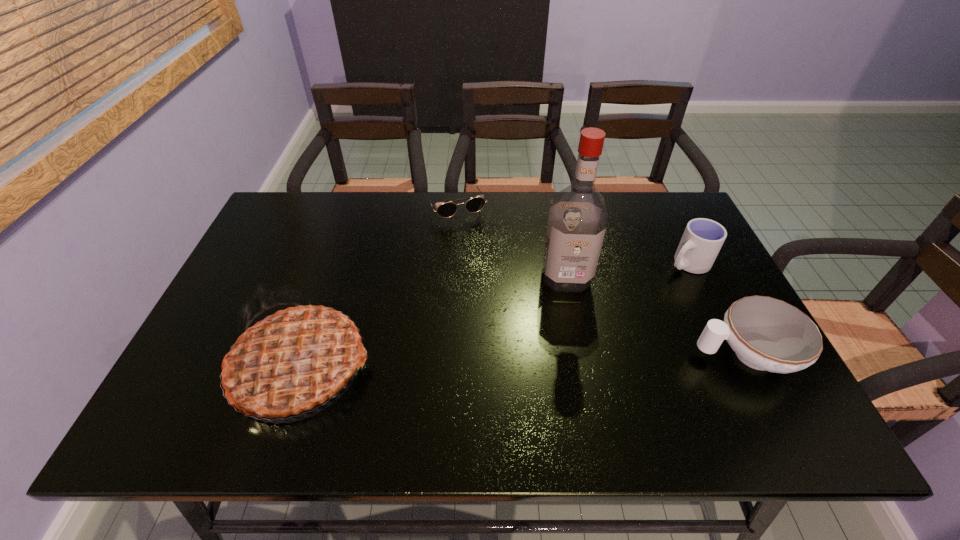
The image size is (960, 540). What are the coordinates of `vacant area located 0.070m on the front lenses of the sunglasses` in the screenshot? It's located at (471, 239).

The height and width of the screenshot is (540, 960). In order to click on object that is at the far edge in this screenshot , I will do `click(473, 205)`.

You are a GUI agent. You are given a task and a screenshot of the screen. Output one action in this format:
    pyautogui.click(x=<x>, y=<y>)
    Task: Click on the pie at the near edge
    The image size is (960, 540).
    Given the screenshot: What is the action you would take?
    pyautogui.click(x=292, y=360)

Find the location of a particular element. This screenshot has width=960, height=540. chinaware that is at the near edge is located at coordinates (769, 334).

This screenshot has width=960, height=540. I want to click on object located in the left edge section of the desktop, so click(292, 360).

Find the location of a particular element. This screenshot has height=540, width=960. chinaware at the right edge is located at coordinates (769, 334).

Identify the location of cup present at the right edge. The image size is (960, 540). (703, 238).

The width and height of the screenshot is (960, 540). I want to click on object present at the near left corner, so click(x=292, y=360).

Find the location of `object that is at the near right corner`. object that is at the near right corner is located at coordinates (769, 334).

At what (x,y) coordinates should I click in order to perform the action: click on free spot at the far edge of the desktop. Please return your answer as a coordinate pair (x, y). Looking at the image, I should click on (641, 227).